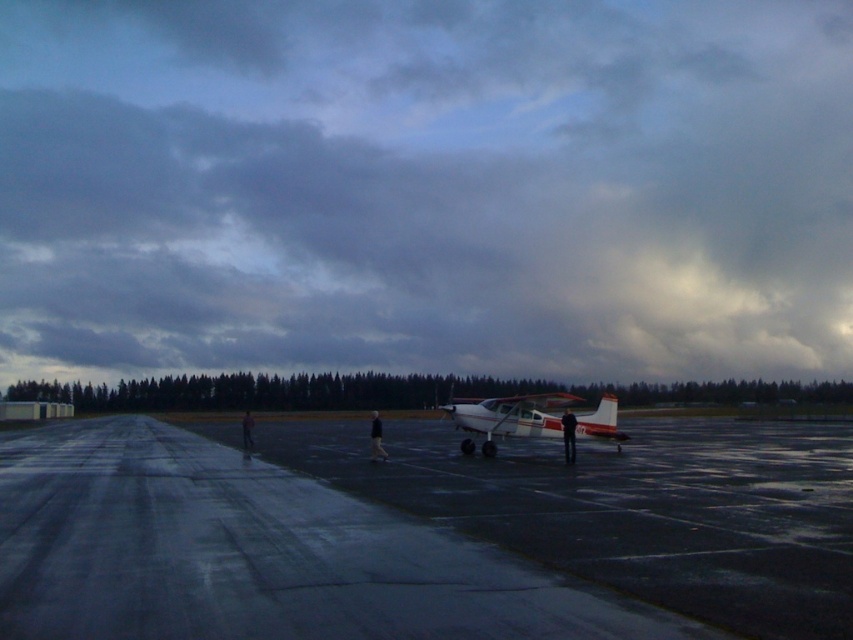
You are standing on the glossy asphalt tarmac at center and looking towards the cloudy sky at upper center. Which object is closer to your eyes?

The cloudy sky at upper center is closer to your eyes because it is positioned further to the viewer than the glossy asphalt tarmac at center.

You are a pilot preparing to take off from the airfield. You notice the cloudy sky at upper center and the white matte airplane at center. Which object in the scene takes up more space in the image?

The cloudy sky at upper center takes up more space in the image than the white matte airplane at center because it is described as bigger.

You are a pilot trying to park your white matte airplane at center on the glossy asphalt tarmac at center. Considering the size of the tarmac and the airplane, will there be enough space for the airplane to park without touching the edges?

The glossy asphalt tarmac at center is larger in size compared to the white matte airplane at center, so there will be enough space for the airplane to park without touching the edges.